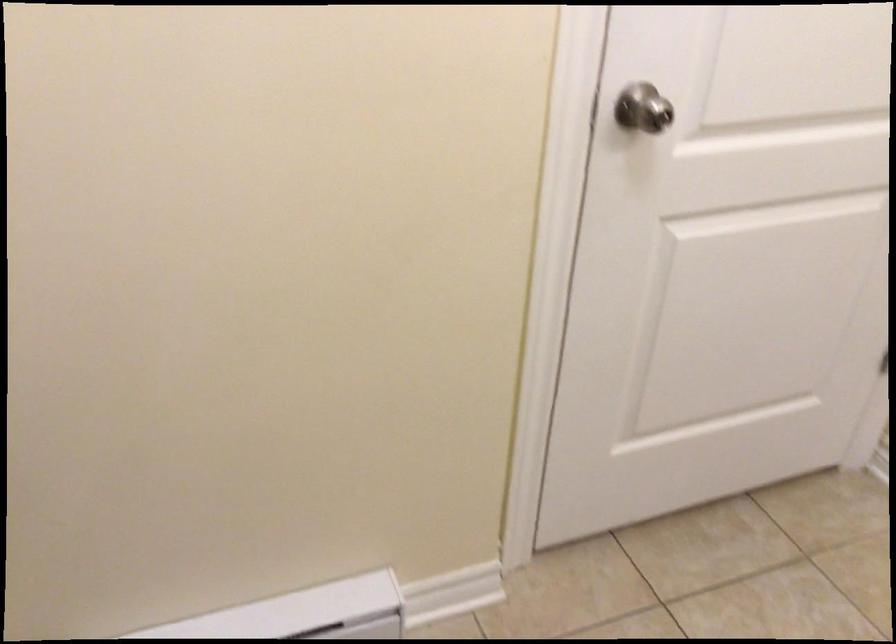
Describe the element at coordinates (642, 108) in the screenshot. I see `the silver door knob` at that location.